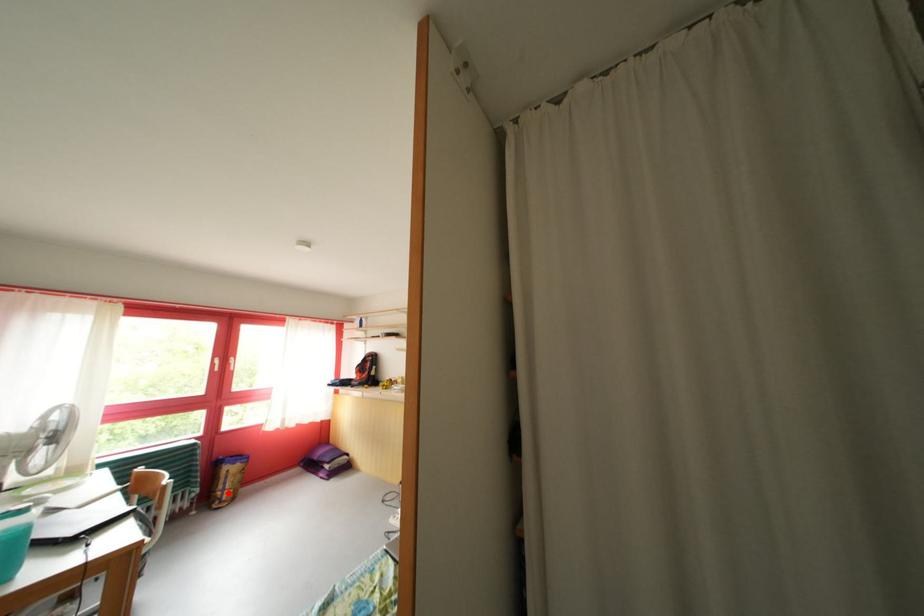
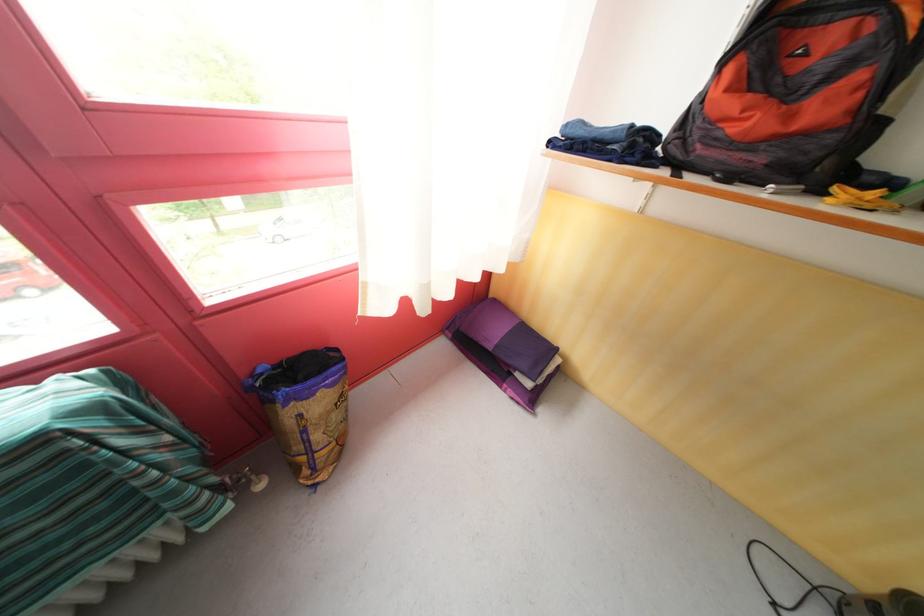
Question: I am providing you with two images of the same scene from different viewpoints. In image1, a red point is highlighted. Considering the same 3D point in image2, which of the following is correct?

Choices:
 (A) It is closer
 (B) It is farther

Answer: (B)